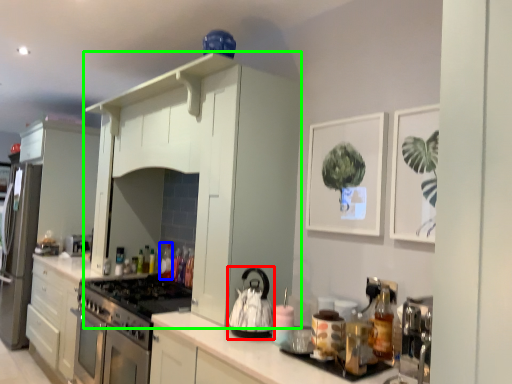
Question: Which is nearer to the kitchen appliance (highlighted by a red box)? bottle (highlighted by a blue box) or cabinetry (highlighted by a green box).

Choices:
 (A) bottle
 (B) cabinetry

Answer: (B)